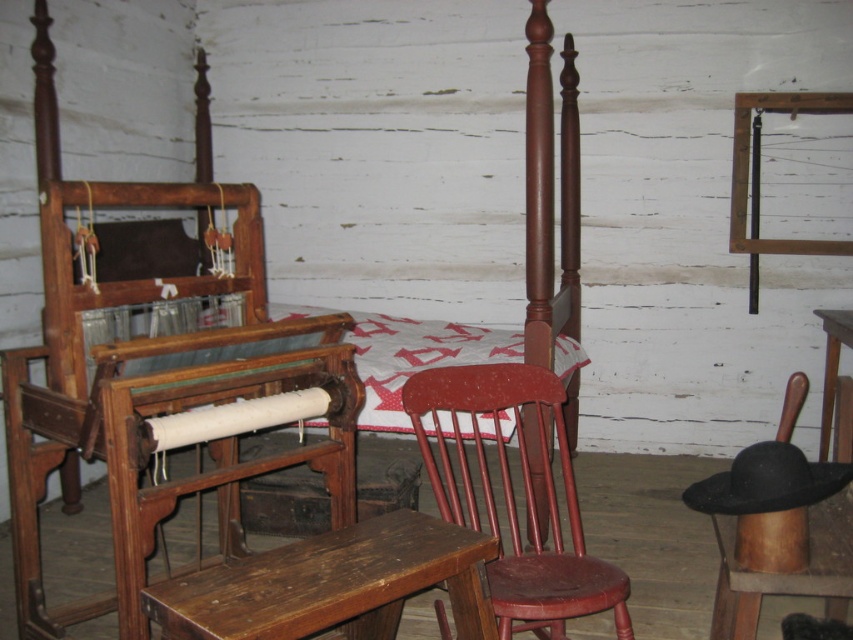
You are a tailor working in this rustic workshop and need to move a sewing kit from the matte red wooden chair at center to the white quilted fabric at center. Can you place the kit directly between them without moving either object?

The distance between the matte red wooden chair at center and the white quilted fabric at center is 21.48 inches, so yes, you can place the sewing kit directly between them as there is enough space.

You are standing in the room and want to know which of the two points, point (x=521, y=595) or point (x=503, y=358), is closer to you. Can you determine this based on the scene?

Point (x=521, y=595) is closer to the camera than point (x=503, y=358), so it is closer to you.

You are standing in the rustic interior scene. You need to place a small potted plant on the wooden bench at center. Where exactly should you place it?

The wooden bench at center is located at point (334,584), so place the potted plant there.